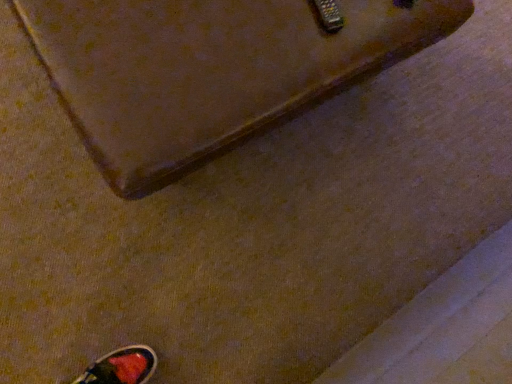
Locate an element on the screen. vacant space to the right of leather suitcase at upper center is located at coordinates (399, 165).